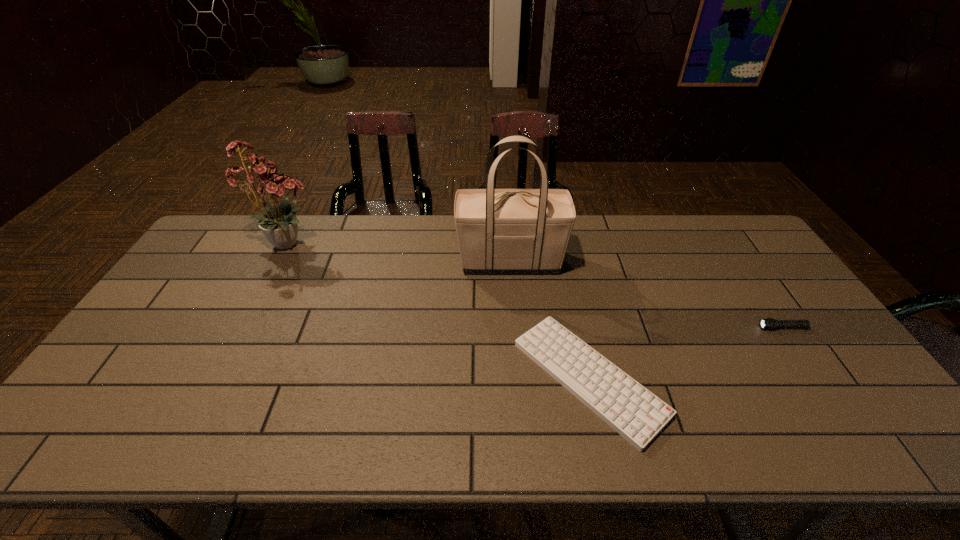
Identify the location of shopping bag. This screenshot has height=540, width=960. (500, 231).

Identify the location of flower arrangement. The width and height of the screenshot is (960, 540). (280, 224).

Locate an element on the screen. This screenshot has width=960, height=540. the rightmost object is located at coordinates (769, 323).

The image size is (960, 540). In order to click on computer keyboard in this screenshot , I will do `click(634, 412)`.

I want to click on vacant space located with handles facing forward on the shopping bag, so click(x=343, y=262).

The width and height of the screenshot is (960, 540). I want to click on vacant area situated with handles facing forward on the shopping bag, so click(x=365, y=262).

Where is `free location located with handles facing forward on the shopping bag`? The image size is (960, 540). free location located with handles facing forward on the shopping bag is located at coordinates (368, 262).

Where is `free spot located 0.070m on the front-facing side of the leftmost object`? The height and width of the screenshot is (540, 960). free spot located 0.070m on the front-facing side of the leftmost object is located at coordinates (348, 243).

The height and width of the screenshot is (540, 960). I want to click on free space located 0.220m at the lens end of the rightmost object, so click(x=681, y=327).

In order to click on free space located at the lens end of the rightmost object in this screenshot , I will do `click(659, 327)`.